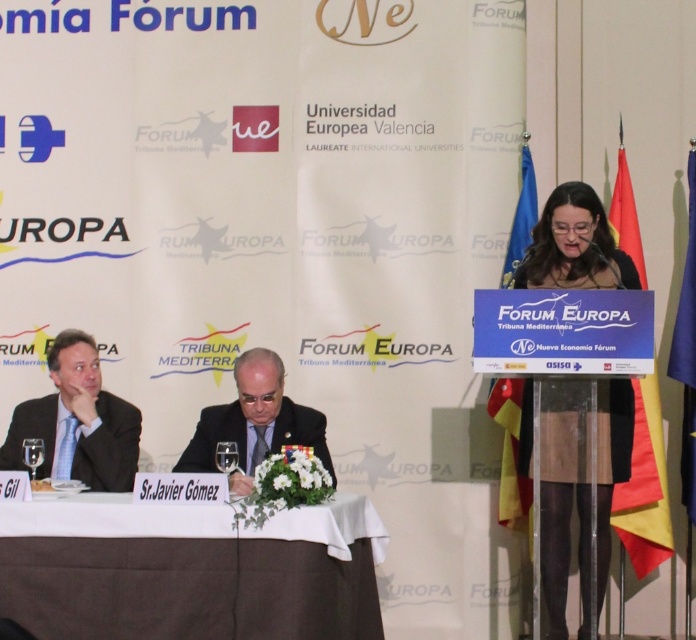
You are attending the event and need to place a nameplate between the white cloth at lower center and the dark suit at center. Which object should the nameplate be placed closer to?

The nameplate should be placed closer to the dark suit at center because the white cloth at lower center is positioned under it, meaning the dark suit at center is above the cloth and closer to the viewer.